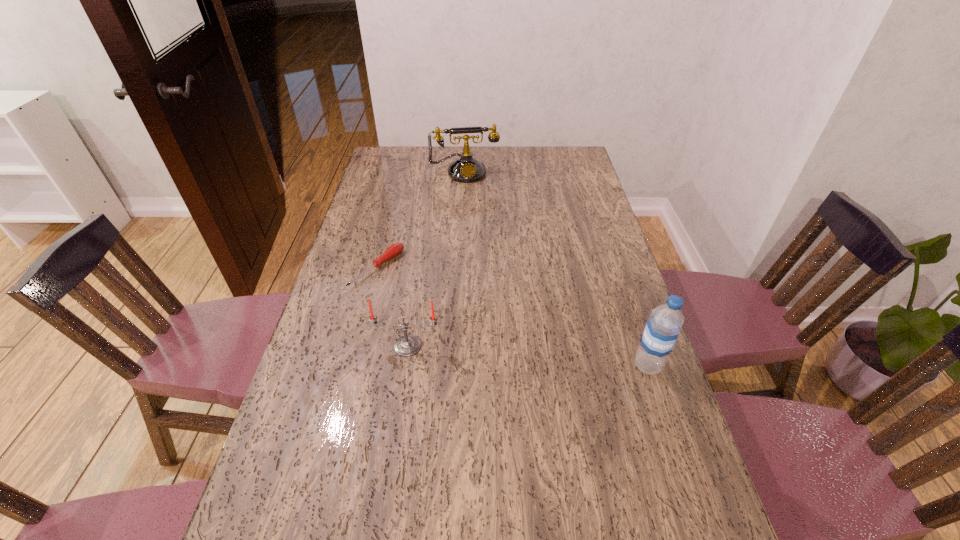
You are a GUI agent. You are given a task and a screenshot of the screen. Output one action in this format:
    pyautogui.click(x=<x>, y=<y>)
    Task: Click on the free space that is in between the screwdriver and the candle
    Image resolution: width=960 pixels, height=540 pixels.
    Given the screenshot: What is the action you would take?
    pyautogui.click(x=393, y=307)

At what (x,y) coordinates should I click in order to perform the action: click on free area in between the telephone and the candle. Please return your answer as a coordinate pair (x, y). Looking at the image, I should click on (436, 259).

You are a GUI agent. You are given a task and a screenshot of the screen. Output one action in this format:
    pyautogui.click(x=<x>, y=<y>)
    Task: Click on the unoccupied area between the screwdriver and the water bottle
    This screenshot has width=960, height=540.
    Given the screenshot: What is the action you would take?
    click(513, 317)

Find the location of `object that stands as the closest to the farthest object`. object that stands as the closest to the farthest object is located at coordinates (394, 250).

Identify which object is the closest to the rightmost object. Please provide its 2D coordinates. Your answer should be formatted as a tuple, i.e. [(x, y)], where the tuple contains the x and y coordinates of a point satisfying the conditions above.

[(408, 345)]

Where is `free point that satisfies the following two spatial constraints: 1. on the front-facing side of the rightmost object; 2. on the label of the candle`? This screenshot has height=540, width=960. free point that satisfies the following two spatial constraints: 1. on the front-facing side of the rightmost object; 2. on the label of the candle is located at coordinates (405, 366).

This screenshot has height=540, width=960. I want to click on free space that satisfies the following two spatial constraints: 1. on the front-facing side of the candle; 2. on the label of the water bottle, so click(405, 366).

Image resolution: width=960 pixels, height=540 pixels. In order to click on free location that satisfies the following two spatial constraints: 1. on the front-facing side of the water bottle; 2. on the label of the candle in this screenshot , I will do `click(405, 366)`.

Locate an element on the screen. This screenshot has height=540, width=960. free spot that satisfies the following two spatial constraints: 1. on the front side of the rightmost object; 2. on the label of the farthest object is located at coordinates (455, 366).

Locate an element on the screen. free region that satisfies the following two spatial constraints: 1. on the front-facing side of the candle; 2. on the label of the rightmost object is located at coordinates (405, 366).